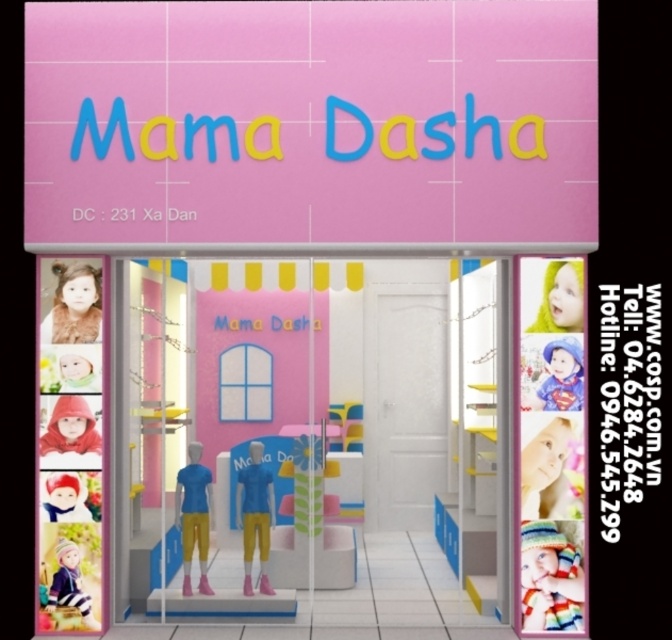
You are standing in front of the Mama Dasha store and see the pastel blonde hair doll at upper right displayed on the storefront. If you want to reach the doll to touch it, would you need to stretch your arm or can you reach it without stretching?

The pastel blonde hair doll at upper right is 9.24 meters from viewer, so you would need to stretch your arm to reach it.

You are a customer looking at the Mama Dasha store sign. You see the smooth plastic barbie at upper right and the matte blue plush at upper right. Which one is positioned to the left of the other?

The smooth plastic barbie at upper right is positioned to the left of the matte blue plush at upper right.

You are a customer looking at the Mama Dasha store. You see the pink glossy shop window at center and the white plush barbie at lower left. Which object is located to the right of the other?

The pink glossy shop window at center is positioned on the right side of white plush barbie at lower left, so the pink glossy shop window at center is to the right of the white plush barbie at lower left.